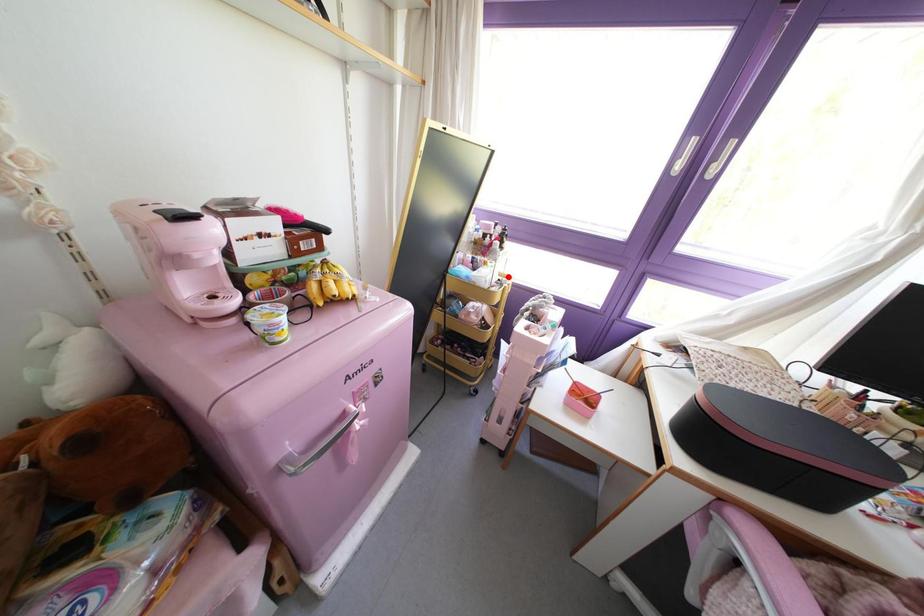
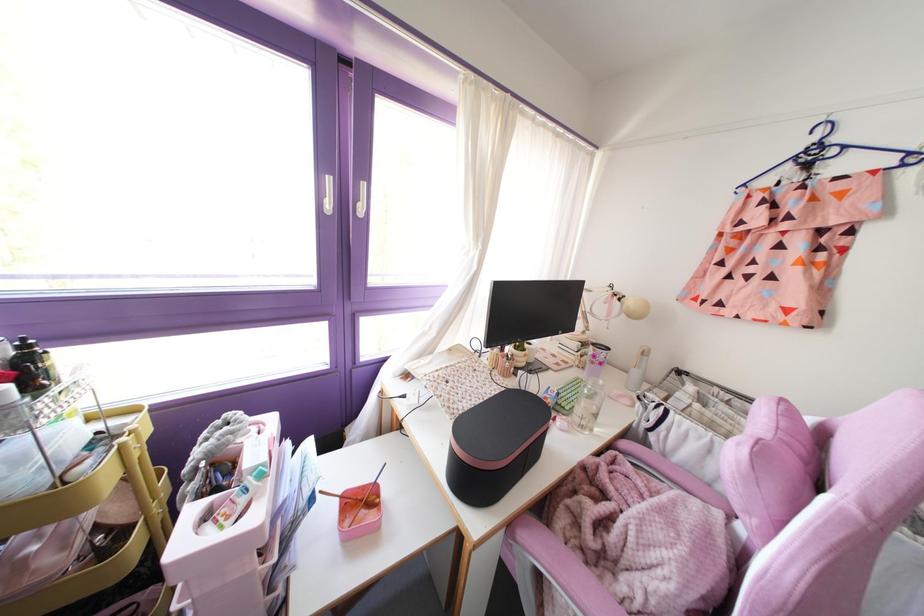
The point at the highlighted location is marked in the first image. Where is the corresponding point in the second image?

(130, 411)